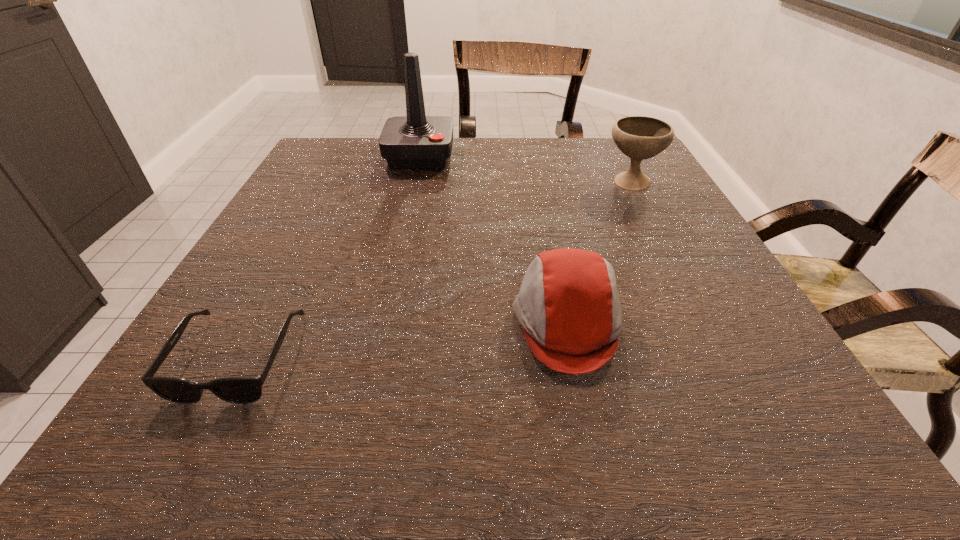
At what (x,y) coordinates should I click in order to perform the action: click on vacant space that satisfies the following two spatial constraints: 1. on the front-facing side of the cap; 2. at the front lenses of the shortest object. Please return your answer as a coordinate pair (x, y). Looking at the image, I should click on (574, 357).

In order to click on free location that satisfies the following two spatial constraints: 1. on the front-facing side of the third object from left to right; 2. at the front lenses of the shortest object in this screenshot , I will do `click(574, 357)`.

Locate an element on the screen. Image resolution: width=960 pixels, height=540 pixels. vacant point that satisfies the following two spatial constraints: 1. on the front side of the second tallest object; 2. on the front-facing side of the third tallest object is located at coordinates (702, 322).

What are the coordinates of `free space that satisfies the following two spatial constraints: 1. on the front-facing side of the second object from right to left; 2. at the front lenses of the shortest object` in the screenshot? It's located at (574, 357).

Where is `vacant area that satisfies the following two spatial constraints: 1. on the front-facing side of the cap; 2. at the front lenses of the leftmost object`? The image size is (960, 540). vacant area that satisfies the following two spatial constraints: 1. on the front-facing side of the cap; 2. at the front lenses of the leftmost object is located at coordinates click(x=574, y=357).